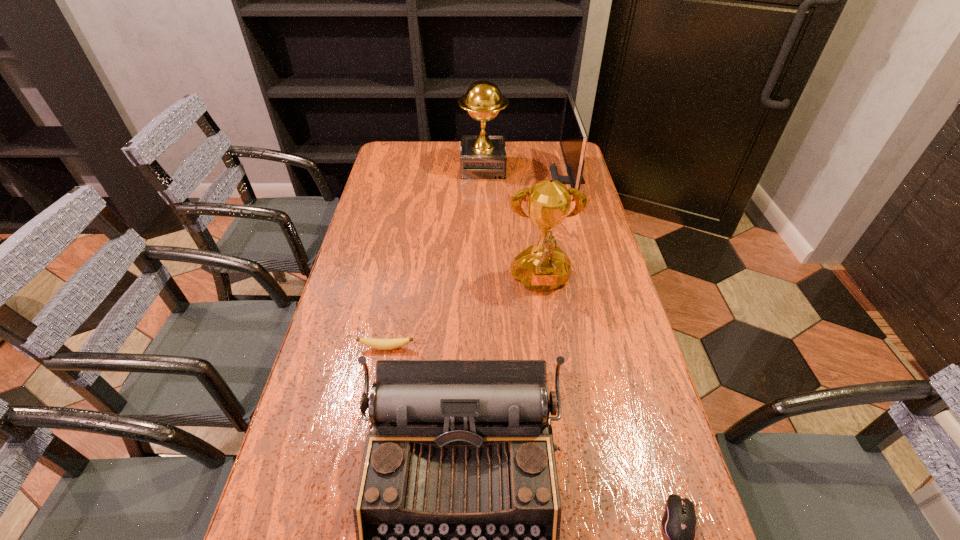
Find the location of a particular element. The image size is (960, 540). the farther award is located at coordinates (482, 156).

Identify the location of the fourth nearest object. (543, 267).

Where is `the fourth shortest object`? the fourth shortest object is located at coordinates (573, 139).

The height and width of the screenshot is (540, 960). I want to click on the fourth farthest object, so click(381, 344).

Find the location of `vacant region located on the front-facing side of the farther award`. vacant region located on the front-facing side of the farther award is located at coordinates (381, 167).

Locate an element on the screen. The height and width of the screenshot is (540, 960). vacant space located on the front-facing side of the farther award is located at coordinates (442, 167).

Identify the location of vacant space located 0.280m on the front-facing side of the farther award. This screenshot has width=960, height=540. (389, 167).

Image resolution: width=960 pixels, height=540 pixels. I want to click on vacant region located 0.240m on the front side of the fourth nearest object, so click(555, 387).

The height and width of the screenshot is (540, 960). What are the coordinates of `vacant region located on the screen side of the fourth shortest object` in the screenshot? It's located at (478, 181).

Find the location of a particular element. The height and width of the screenshot is (540, 960). vacant area situated 0.390m on the screen side of the fourth shortest object is located at coordinates (448, 181).